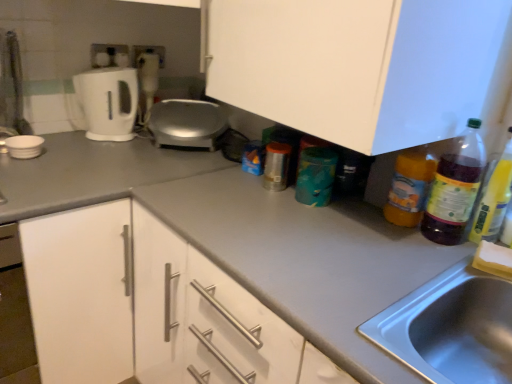
You are a GUI agent. You are given a task and a screenshot of the screen. Output one action in this format:
    pyautogui.click(x=<x>, y=<y>)
    Task: Click on the vacant space to the right of white glossy electric kettle at upper left
    
    Given the screenshot: What is the action you would take?
    pyautogui.click(x=132, y=139)